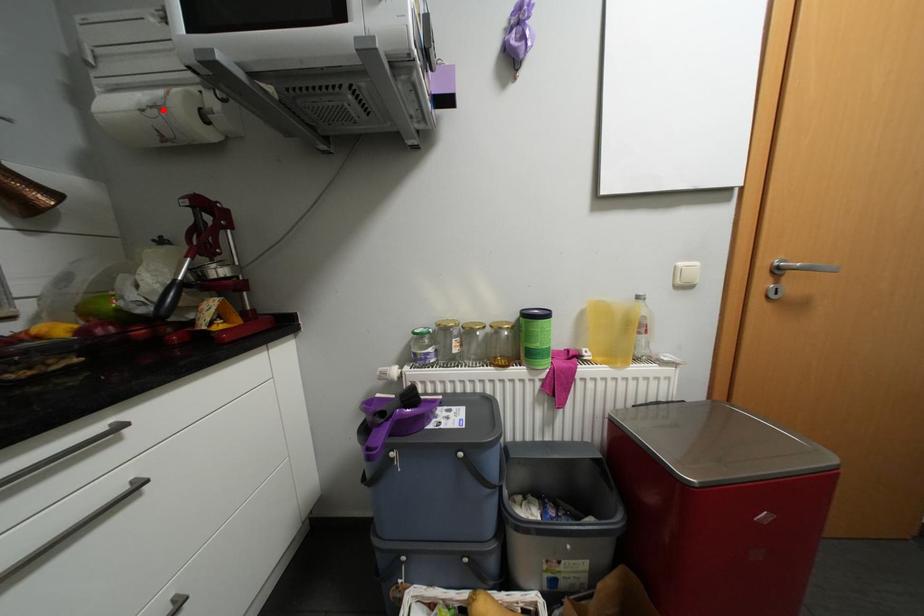
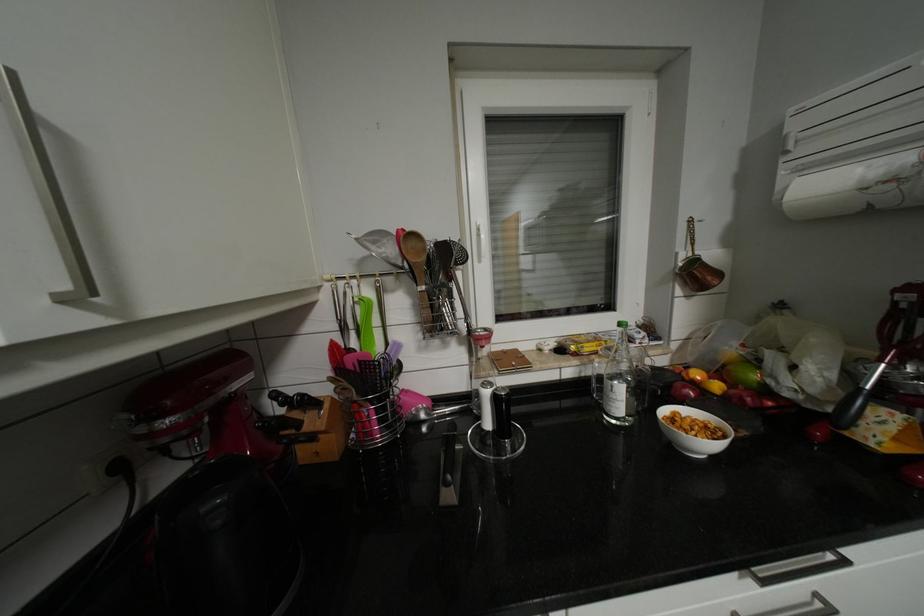
Find the pixel in the second image that matches the highlighted location in the first image.

(898, 185)